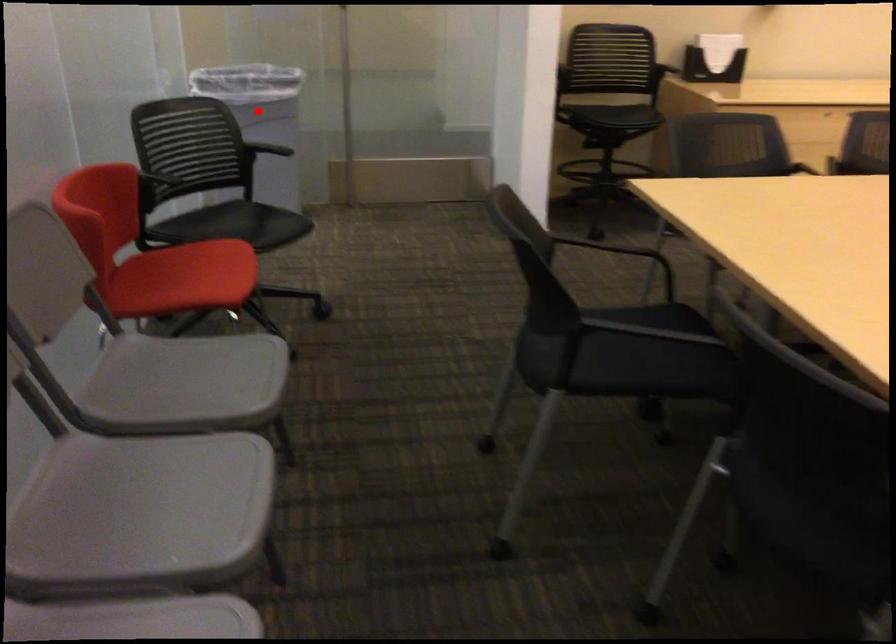
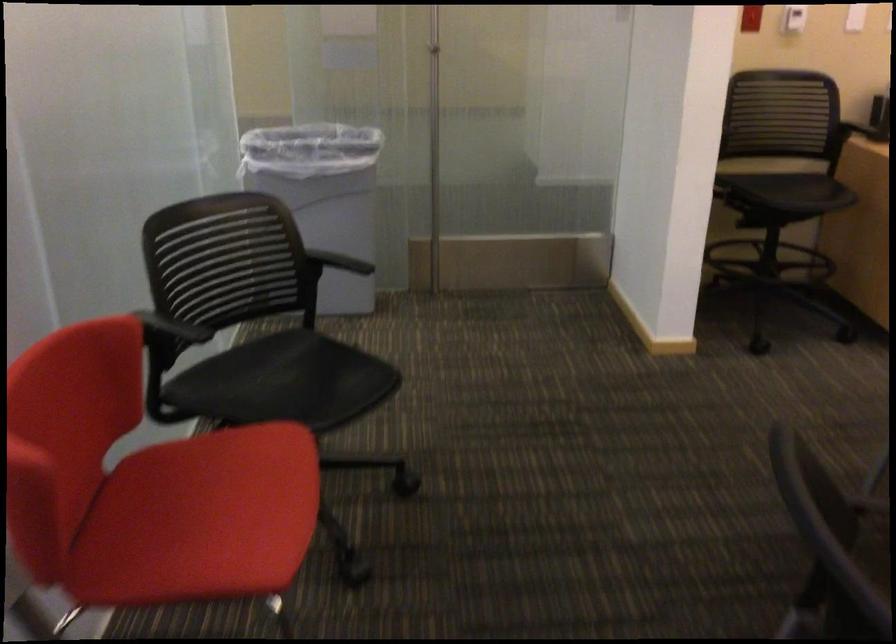
Where in the second image is the point corresponding to the highlighted location from the first image?

(323, 196)